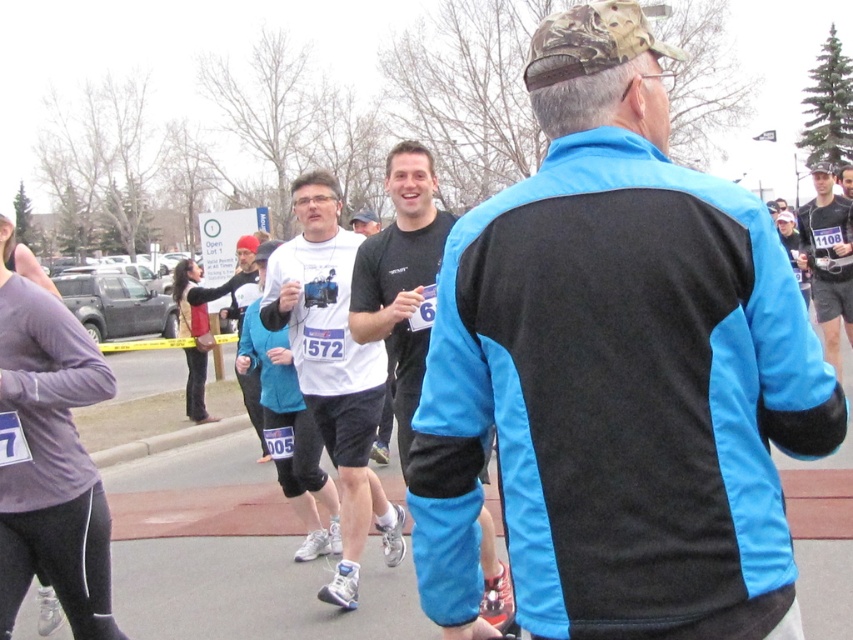
You are a runner in the marathon and you see the point at coordinates (616, 372). What object is located at that point?

The point at coordinates (616, 372) corresponds to the blue and black jacket at center.